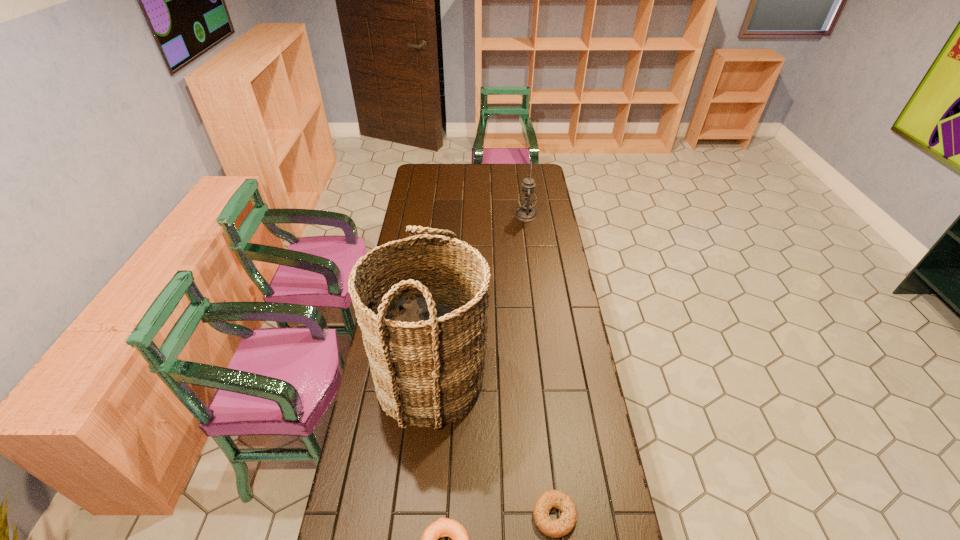
This screenshot has width=960, height=540. In order to click on basket in this screenshot , I will do `click(427, 354)`.

Image resolution: width=960 pixels, height=540 pixels. Find the location of `the tallest object`. the tallest object is located at coordinates (427, 354).

Find the location of a particular element. The width and height of the screenshot is (960, 540). the second tallest object is located at coordinates (527, 199).

You are a GUI agent. You are given a task and a screenshot of the screen. Output one action in this format:
    pyautogui.click(x=<x>, y=<y>)
    Task: Click on the oil lamp
    The image size is (960, 540).
    Given the screenshot: What is the action you would take?
    pyautogui.click(x=527, y=199)

Where is `free space located 0.280m on the right of the third nearest object`? The image size is (960, 540). free space located 0.280m on the right of the third nearest object is located at coordinates (x=569, y=381).

Identify the location of vacant space located 0.300m on the front of the oil lamp. The height and width of the screenshot is (540, 960). click(x=532, y=262).

The height and width of the screenshot is (540, 960). Identify the location of object that is at the left edge. (427, 354).

Locate an element on the screen. object present at the right edge is located at coordinates (527, 199).

Identify the location of vacant space at the left edge of the desktop. [389, 495].

You are a GUI agent. You are given a task and a screenshot of the screen. Output one action in this format:
    pyautogui.click(x=<x>, y=<y>)
    Task: Click on the free space at the right edge
    The image size is (960, 540).
    Given the screenshot: What is the action you would take?
    pyautogui.click(x=549, y=335)